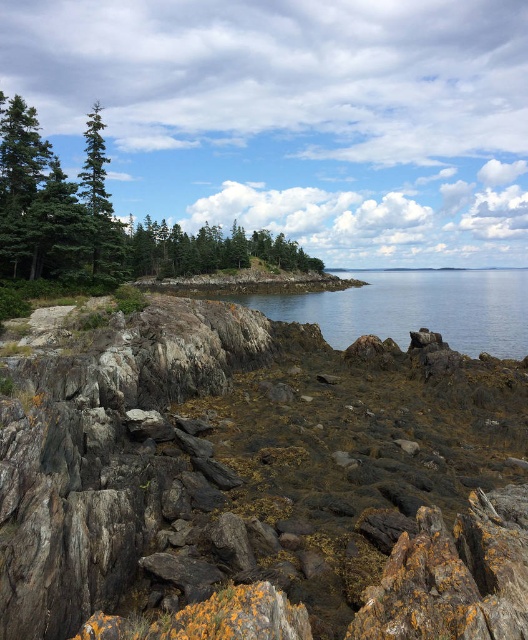
Question: In this image, where is rusty rock at center located relative to green matte tree at upper left?

Choices:
 (A) right
 (B) left

Answer: (A)

Question: Which point appears farthest from the camera in this image?

Choices:
 (A) (315, 268)
 (B) (154, 232)
 (C) (205, 332)

Answer: (A)

Question: Based on their relative distances, which object is farther from the green matte tree at upper left?

Choices:
 (A) green matte trees at center
 (B) rusty rock at center

Answer: (B)

Question: Which object is closer to the camera taking this photo?

Choices:
 (A) rusty rock at center
 (B) green matte tree at upper left

Answer: (A)

Question: Is rusty rock at center to the left of green matte trees at center from the viewer's perspective?

Choices:
 (A) no
 (B) yes

Answer: (A)

Question: From the image, what is the correct spatial relationship of rusty rock at center in relation to green matte tree at upper left?

Choices:
 (A) below
 (B) above

Answer: (A)